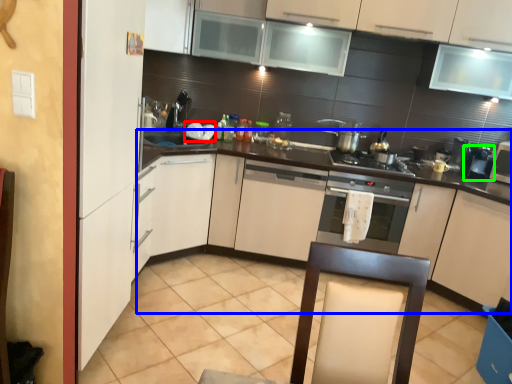
Question: Considering the real-world distances, which object is farthest from appliance (highlighted by a red box)? counter (highlighted by a blue box) or coffee machine (highlighted by a green box)?

Choices:
 (A) counter
 (B) coffee machine

Answer: (B)